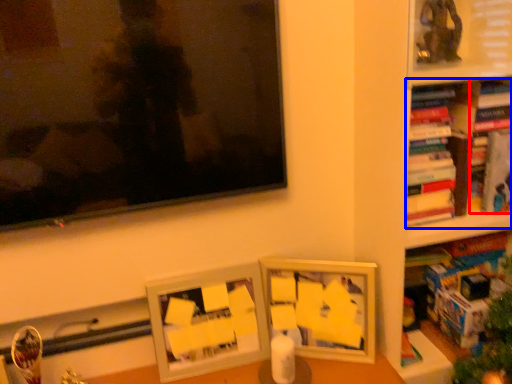
Question: Which object is closer to the camera taking this photo, book (highlighted by a red box) or book (highlighted by a blue box)?

Choices:
 (A) book
 (B) book

Answer: (B)